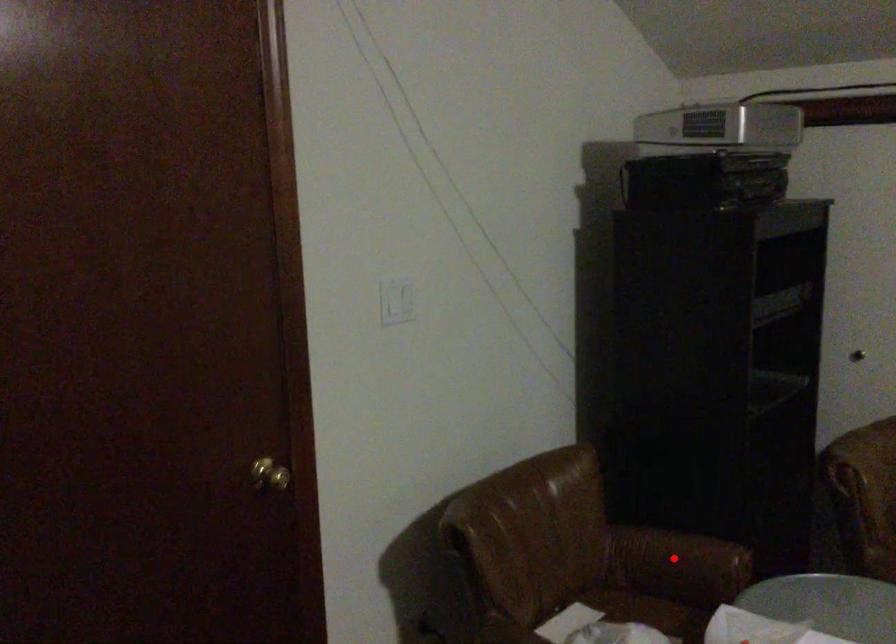
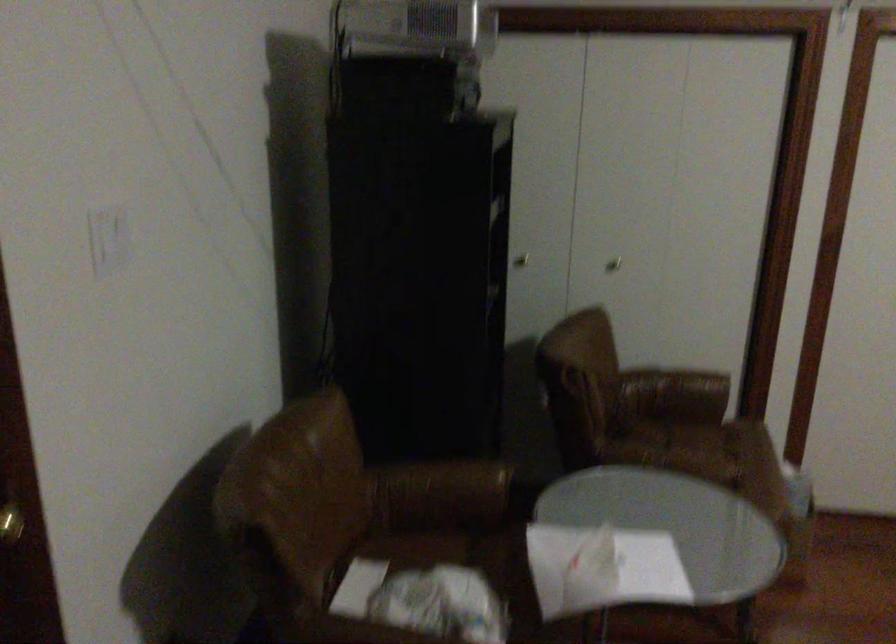
In the second image, find the point that corresponds to the highlighted location in the first image.

(442, 488)